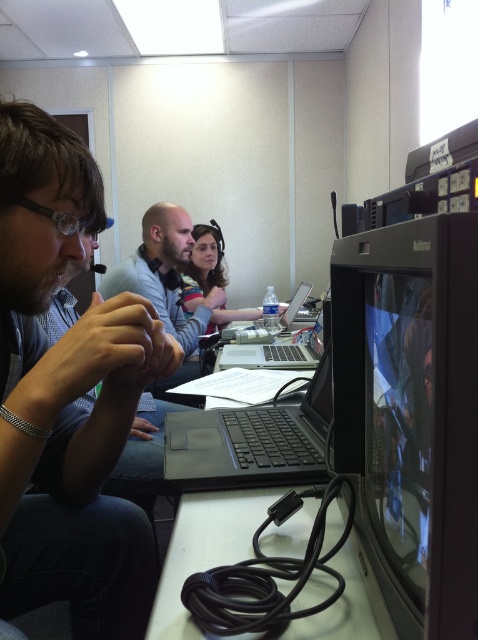
Based on the photo, can you confirm if matte black laptop at left is shorter than satin black laptop at center?

No, matte black laptop at left is not shorter than satin black laptop at center.

Is point (101, 508) less distant than point (284, 355)?

Yes.

What do you see at coordinates (66, 396) in the screenshot?
I see `matte black laptop at left` at bounding box center [66, 396].

Locate an element on the screen. matte black laptop at left is located at coordinates (x=66, y=396).

Does matte black laptop at left appear under smooth gray shirt at center?

Indeed, matte black laptop at left is positioned under smooth gray shirt at center.

Based on the photo, does matte black laptop at left come behind smooth gray shirt at center?

That is False.

Locate an element on the screen. Image resolution: width=478 pixels, height=640 pixels. matte black laptop at left is located at coordinates (66, 396).

Does point (56, 385) come closer to viewer compared to point (373, 419)?

Yes.

Does point (72, 200) lie behind point (409, 547)?

Yes.

Locate an element on the screen. This screenshot has height=640, width=478. matte black laptop at left is located at coordinates (66, 396).